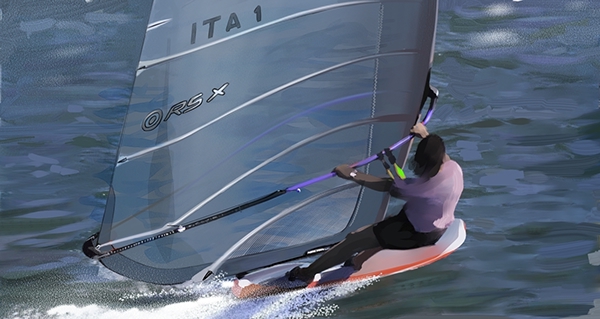
The image size is (600, 319). I want to click on painting of windsurfer, so click(443, 195).